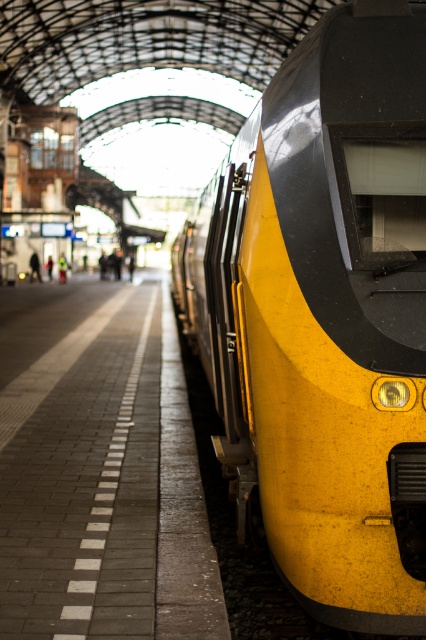
Consider the image. You are a passenger standing on the brick platform at center and want to board the yellow matte train at right. Which direction should you walk to reach the train?

The yellow matte train at right is below the brick platform at center, so you should walk downward towards the yellow matte train at right to board it.

You are standing on the train station platform and see two points marked on the ground. The first point is at point (x=290, y=241) and the second is at point (x=54, y=509). Which point is closer to you?

Point (x=290, y=241) is closer to the viewer than point (x=54, y=509).

You are a passenger waiting at the train station. You see the yellow matte train at right and the brick platform at center. Which one is closer to the edge of the platform?

The yellow matte train at right is closer to the edge of the platform than the brick platform at center because it is shorter.